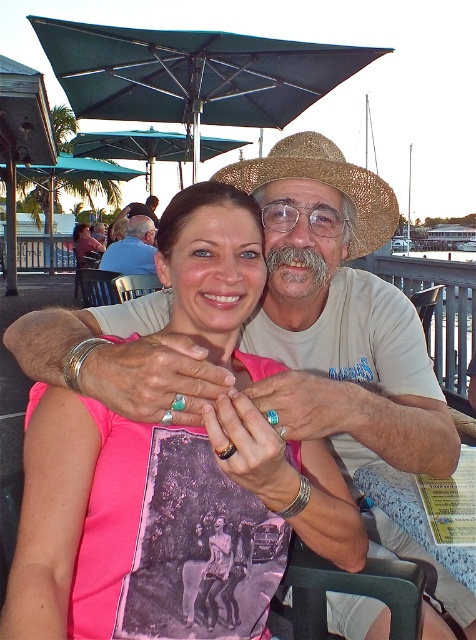
Question: Can you confirm if strawhat at center is positioned below matte white shirt at center?

Choices:
 (A) yes
 (B) no

Answer: (A)

Question: Does green fabric umbrella at upper left appear over matte white shirt at center?

Choices:
 (A) no
 (B) yes

Answer: (B)

Question: Which point is farther to the camera?

Choices:
 (A) (161, 161)
 (B) (126, 176)
 (C) (357, 234)
 (D) (141, 237)

Answer: (B)

Question: Which point is closer to the camera taking this photo?

Choices:
 (A) (276, 584)
 (B) (107, 248)
 (C) (6, 250)

Answer: (A)

Question: Is teal fabric umbrella at upper center thinner than matte white shirt at center?

Choices:
 (A) yes
 (B) no

Answer: (B)

Question: Which point is farther to the camera?

Choices:
 (A) matte white shirt at center
 (B) green fabric umbrella at upper left
 (C) strawhat at center

Answer: (B)